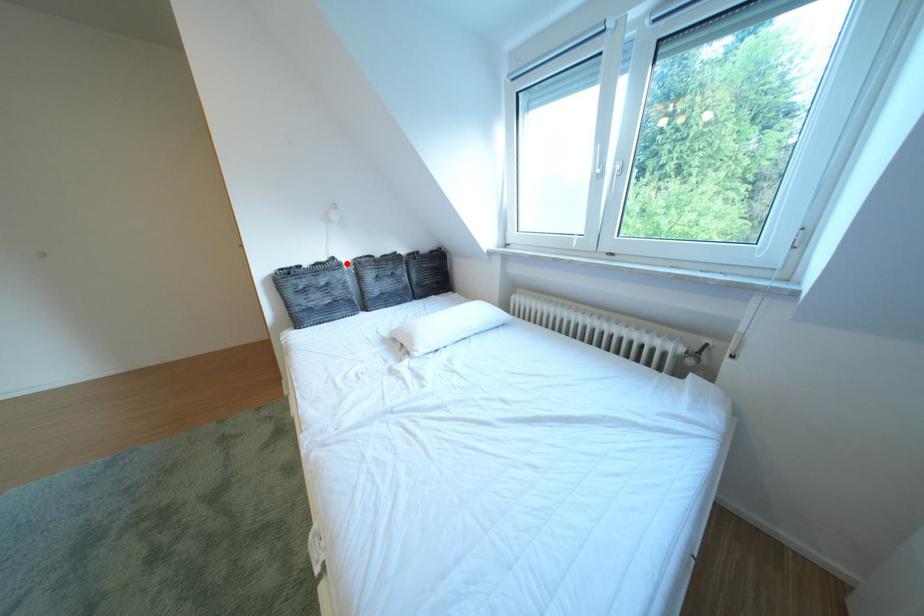
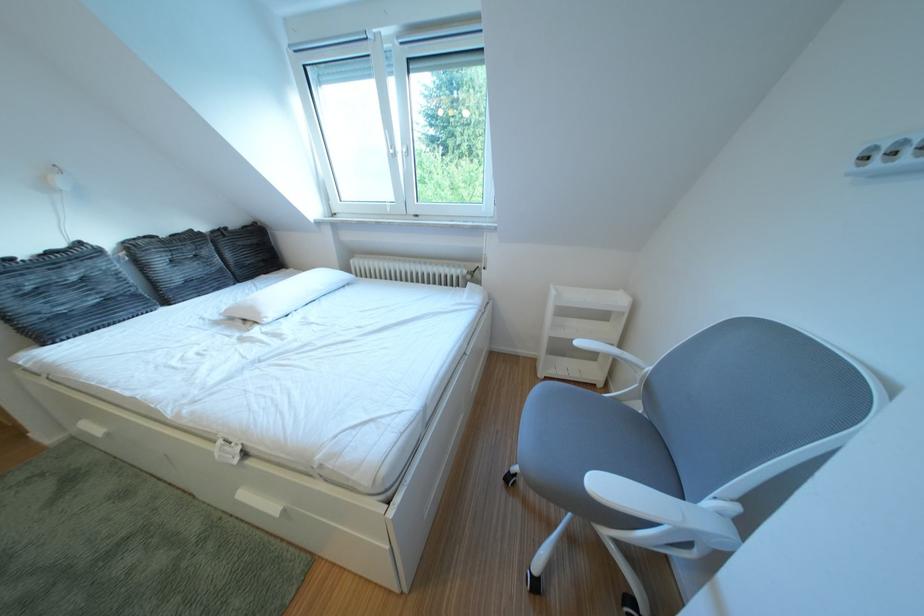
The point at the highlighted location is marked in the first image. Where is the corresponding point in the second image?

(93, 249)